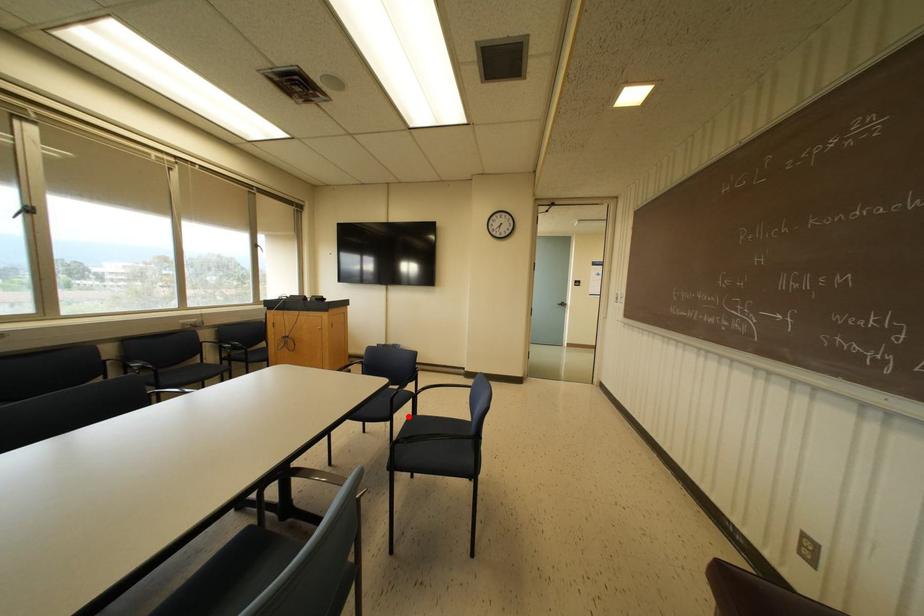
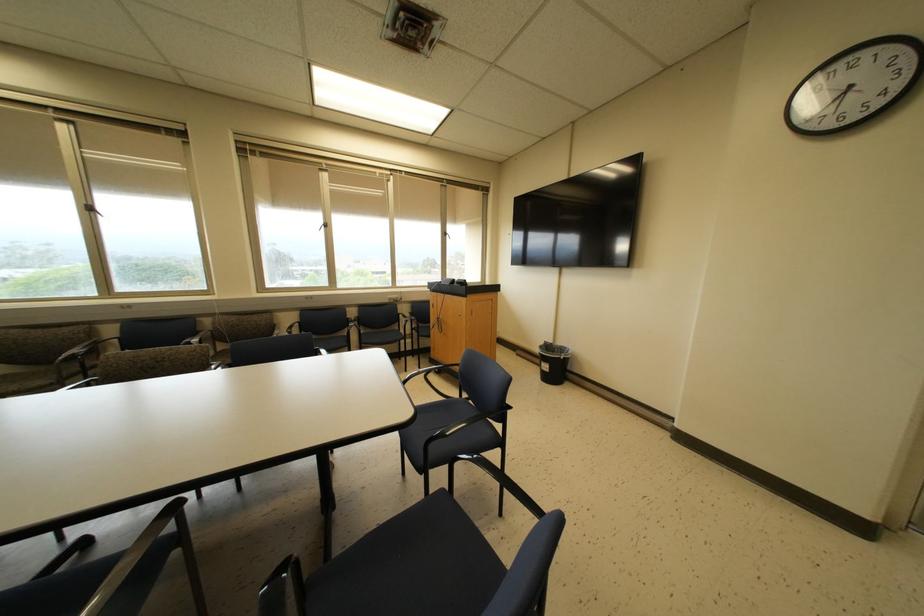
Where in the second image is the point corresponding to the highlighted location from the first image?

(442, 488)